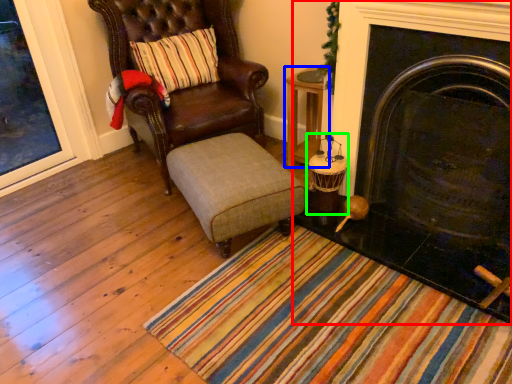
Question: Based on their relative distances, which object is farther from fireplace (highlighted by a red box)? Choose from table (highlighted by a blue box) and candle holder (highlighted by a green box).

Choices:
 (A) table
 (B) candle holder

Answer: (A)